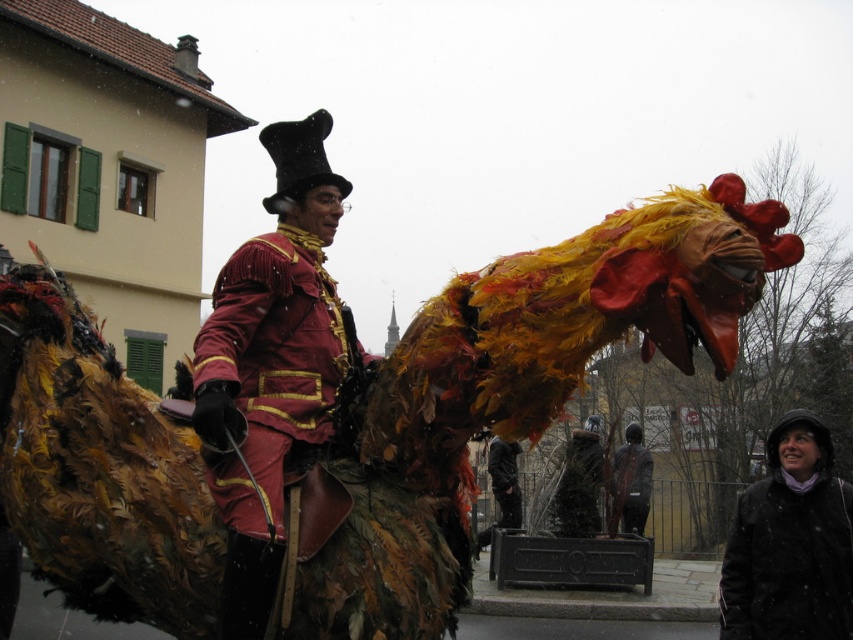
Is shiny red coat at center above black statue at center?

Yes.

Can you confirm if shiny red coat at center is positioned to the right of black statue at center?

Incorrect, shiny red coat at center is not on the right side of black statue at center.

Identify the location of shiny red coat at center. (271, 365).

Consider the image. Between shiny red coat at center and black woolen coat at lower right, which one has less height?

Standing shorter between the two is black woolen coat at lower right.

Is shiny red coat at center shorter than black woolen coat at lower right?

Incorrect, shiny red coat at center's height does not fall short of black woolen coat at lower right's.

Locate an element on the screen. shiny red coat at center is located at coordinates (271, 365).

Does black woolen coat at lower right lie in front of black statue at center?

That is True.

Does point (810, 544) lie behind point (636, 422)?

No, (810, 544) is closer to viewer.

This screenshot has height=640, width=853. Find the location of `black woolen coat at lower right`. black woolen coat at lower right is located at coordinates (790, 541).